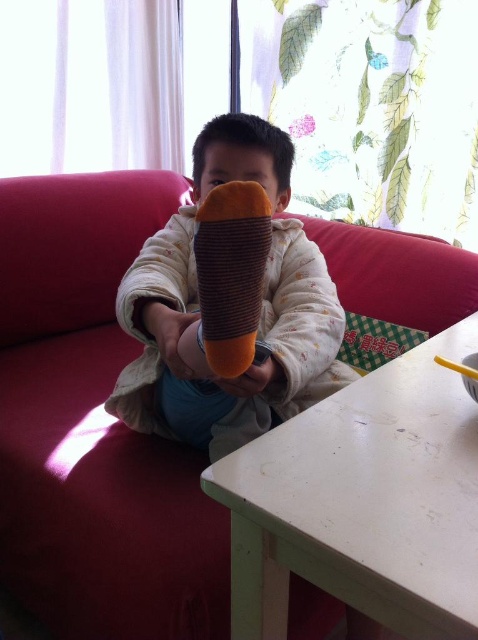
Between velvet-like red couch at center and brown textured sock at center, which one has less height?

brown textured sock at center is shorter.

Consider the image. Which is above, velvet-like red couch at center or brown textured sock at center?

brown textured sock at center

You are a GUI agent. You are given a task and a screenshot of the screen. Output one action in this format:
    pyautogui.click(x=<x>, y=<y>)
    Task: Click on the velvet-like red couch at center
    This screenshot has width=478, height=640.
    Given the screenshot: What is the action you would take?
    pyautogui.click(x=94, y=428)

Where is `velvet-like red couch at center`? velvet-like red couch at center is located at coordinates (94, 428).

Between velvet-like red couch at center and soft plush toy at center, which one appears on the left side from the viewer's perspective?

From the viewer's perspective, velvet-like red couch at center appears more on the left side.

Does velvet-like red couch at center appear on the left side of soft plush toy at center?

Correct, you'll find velvet-like red couch at center to the left of soft plush toy at center.

Is point (76, 253) positioned in front of point (185, 435)?

No, it is behind (185, 435).

Locate an element on the screen. The width and height of the screenshot is (478, 640). velvet-like red couch at center is located at coordinates (94, 428).

Is point (43, 317) less distant than point (250, 513)?

No, it is behind (250, 513).

Who is positioned more to the right, velvet-like red couch at center or white matte table at lower center?

white matte table at lower center

Which is in front, point (88, 547) or point (262, 595)?

Point (262, 595) is in front.

This screenshot has width=478, height=640. In order to click on velvet-like red couch at center in this screenshot , I will do coord(94,428).